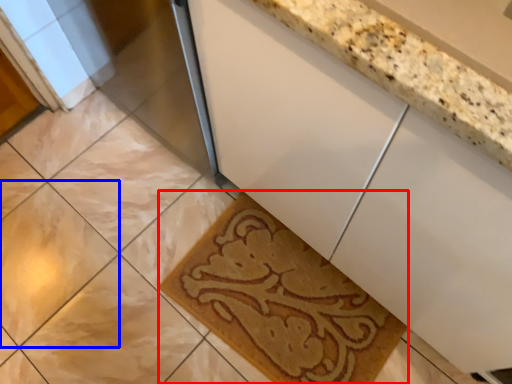
Question: Among these objects, which one is farthest to the camera, bath mat (highlighted by a red box) or ceramic tile (highlighted by a blue box)?

Choices:
 (A) bath mat
 (B) ceramic tile

Answer: (B)